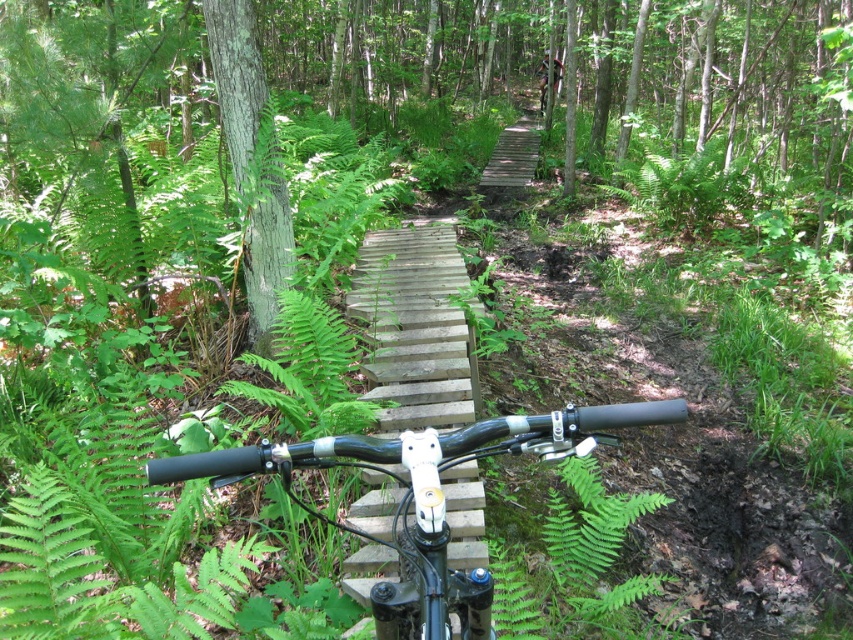
Who is positioned more to the left, black matte handlebars at center or wooden bridge at center?

From the viewer's perspective, wooden bridge at center appears more on the left side.

Is black matte handlebars at center bigger than wooden bridge at center?

No, black matte handlebars at center is not bigger than wooden bridge at center.

At what (x,y) coordinates should I click in order to perform the action: click on black matte handlebars at center. Please return your answer as a coordinate pair (x, y). The height and width of the screenshot is (640, 853). Looking at the image, I should click on (425, 499).

This screenshot has width=853, height=640. Find the location of `black matte handlebars at center`. black matte handlebars at center is located at coordinates (425, 499).

Who is more distant from viewer, (358, 438) or (288, 216)?

The point (288, 216) is behind.

Is black matte handlebars at center above green rough bark tree at upper left?

Incorrect, black matte handlebars at center is not positioned above green rough bark tree at upper left.

Between point (260, 442) and point (254, 262), which one is positioned behind?

The point (254, 262) is behind.

This screenshot has width=853, height=640. Identify the location of black matte handlebars at center. (425, 499).

From the picture: Who is shorter, wooden bridge at center or green rough bark tree at upper left?

wooden bridge at center is shorter.

Which is above, wooden bridge at center or green rough bark tree at upper left?

Result: green rough bark tree at upper left is above.

Where is `wooden bridge at center`? wooden bridge at center is located at coordinates (415, 326).